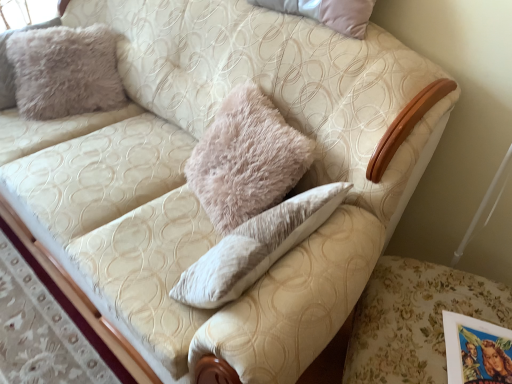
Question: Does point (109, 49) appear closer or farther from the camera than point (425, 340)?

Choices:
 (A) farther
 (B) closer

Answer: (A)

Question: Is fuzzy beige pillow at upper left inside the boundaries of floral fabric swivel chair at lower right, or outside?

Choices:
 (A) outside
 (B) inside

Answer: (A)

Question: Considering the relative positions of fuzzy beige pillow at upper left and floral fabric swivel chair at lower right in the image provided, is fuzzy beige pillow at upper left to the left or to the right of floral fabric swivel chair at lower right?

Choices:
 (A) right
 (B) left

Answer: (B)

Question: Is floral fabric swivel chair at lower right wider or thinner than fuzzy beige pillow at upper left?

Choices:
 (A) thin
 (B) wide

Answer: (B)

Question: Is floral fabric swivel chair at lower right inside or outside of fuzzy beige pillow at upper left?

Choices:
 (A) outside
 (B) inside

Answer: (A)

Question: Visually, is floral fabric swivel chair at lower right positioned to the left or to the right of fuzzy beige pillow at upper left?

Choices:
 (A) right
 (B) left

Answer: (A)

Question: From a real-world perspective, is floral fabric swivel chair at lower right positioned above or below fuzzy beige pillow at upper left?

Choices:
 (A) above
 (B) below

Answer: (B)